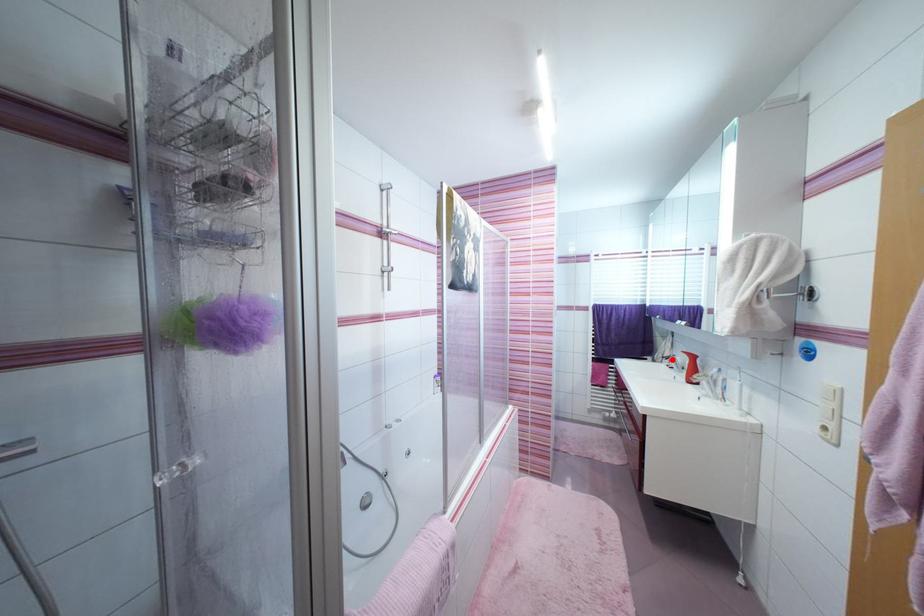
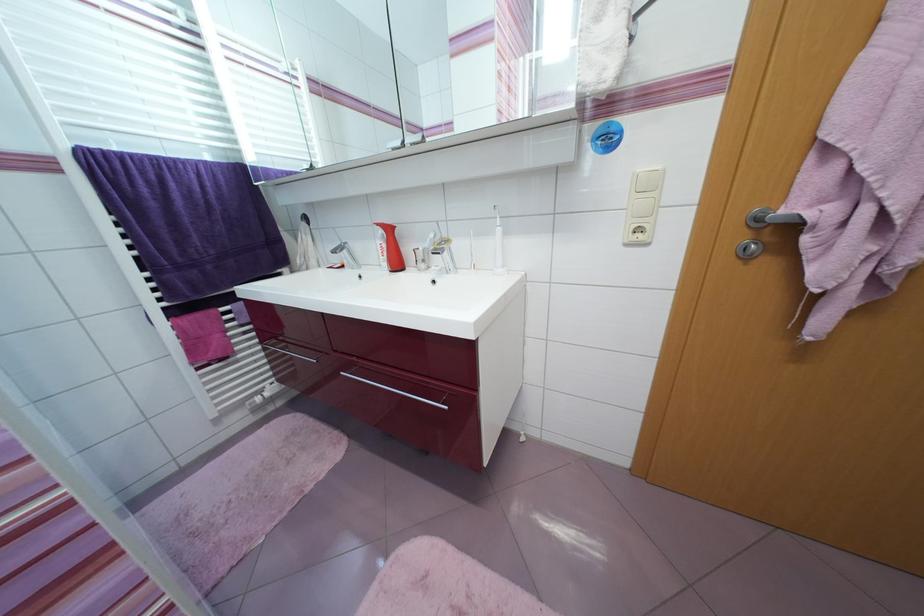
Locate, in the second image, the point that corresponds to the highlighted location in the first image.

(338, 254)